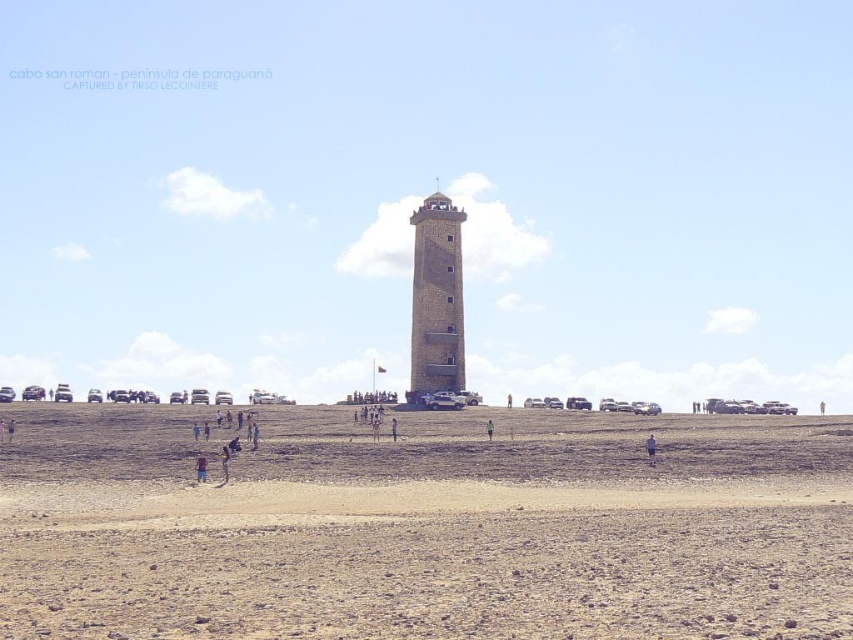
Between point (228, 449) and point (486, 420), which one is positioned behind?

The point (486, 420) is more distant.

Is brown leather shoes at lower center shorter than green fabric person at center?

Yes, brown leather shoes at lower center is shorter than green fabric person at center.

Who is more distant from viewer, (223, 465) or (490, 422)?

Point (490, 422)

Image resolution: width=853 pixels, height=640 pixels. Find the location of `brown leather shoes at lower center`. brown leather shoes at lower center is located at coordinates (224, 465).

Is brown fabric shirt at lower center in front of green fabric person at center?

Yes, it is.

Which is more to the left, brown fabric shirt at lower center or green fabric person at center?

Positioned to the left is brown fabric shirt at lower center.

Which is in front, point (196, 474) or point (486, 436)?

Point (196, 474) is more forward.

You are a GUI agent. You are given a task and a screenshot of the screen. Output one action in this format:
    pyautogui.click(x=<x>, y=<y>)
    Task: Click on the brown fabric shirt at lower center
    The width and height of the screenshot is (853, 640).
    Given the screenshot: What is the action you would take?
    pyautogui.click(x=201, y=467)

Does gray fabric pants at lower center have a smaller size compared to green fabric person at center?

No.

Between point (653, 435) and point (490, 428), which one is positioned in front?

Point (490, 428) is more forward.

The height and width of the screenshot is (640, 853). Describe the element at coordinates (650, 449) in the screenshot. I see `gray fabric pants at lower center` at that location.

In order to click on gray fabric pants at lower center in this screenshot , I will do `click(650, 449)`.